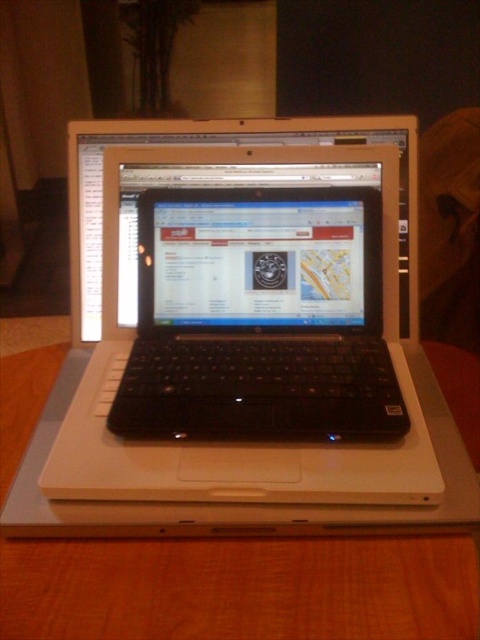
Question: Is black matte laptop at center to the right of wooden table at center from the viewer's perspective?

Choices:
 (A) yes
 (B) no

Answer: (A)

Question: Which point is farther from the camera taking this photo?

Choices:
 (A) (132, 296)
 (B) (148, 566)

Answer: (A)

Question: Is black matte laptop at center smaller than wooden table at center?

Choices:
 (A) no
 (B) yes

Answer: (B)

Question: Can you confirm if black matte laptop at center is positioned below wooden table at center?

Choices:
 (A) yes
 (B) no

Answer: (B)

Question: Which of the following is the closest to the observer?

Choices:
 (A) wooden table at center
 (B) black matte laptop at center

Answer: (A)